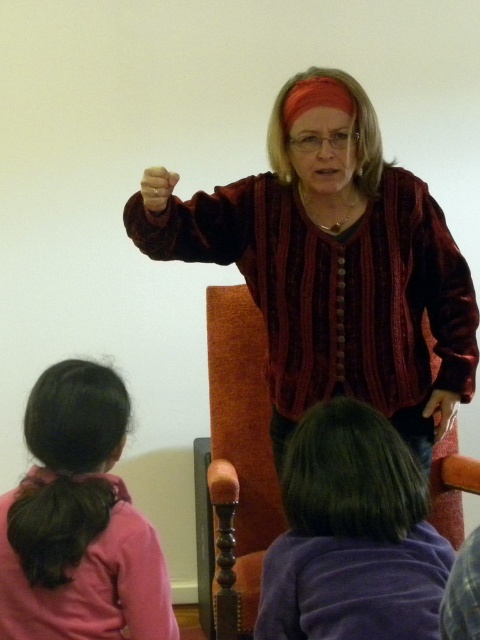
How distant is pink fabric hair at lower left from purple velvet hair at lower center?

pink fabric hair at lower left is 12.57 inches from purple velvet hair at lower center.

Which of these two, pink fabric hair at lower left or purple velvet hair at lower center, stands taller?

Standing taller between the two is pink fabric hair at lower left.

Between point (91, 614) and point (302, 637), which one is positioned behind?

The point (91, 614) is behind.

This screenshot has width=480, height=640. Find the location of `pink fabric hair at lower left`. pink fabric hair at lower left is located at coordinates point(79,522).